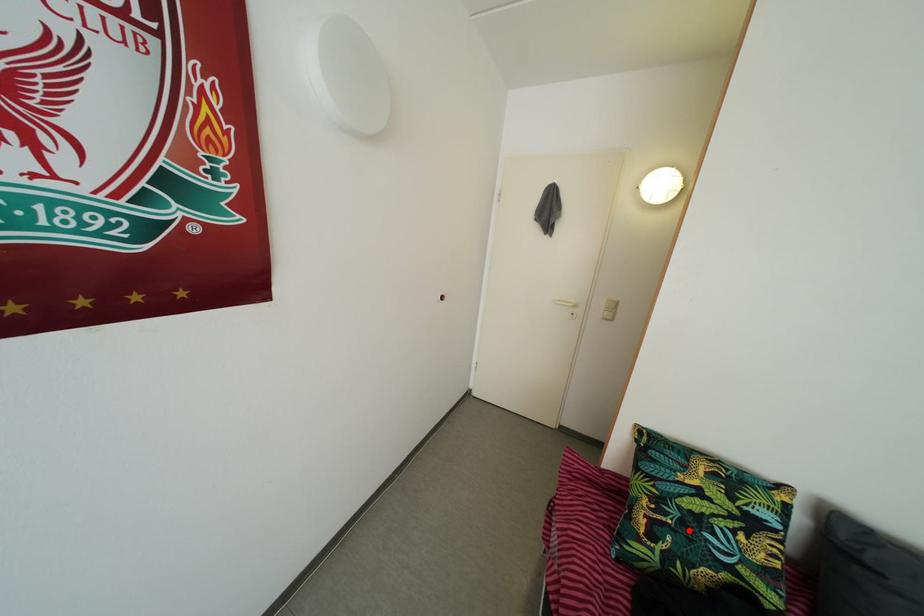
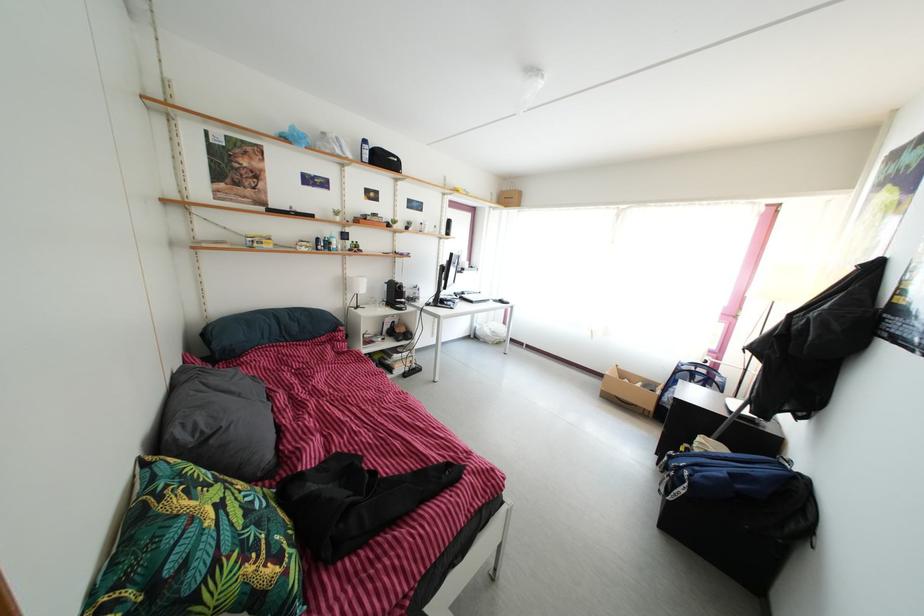
Where in the second image is the point corresponding to the highlighted location from the first image?

(264, 533)